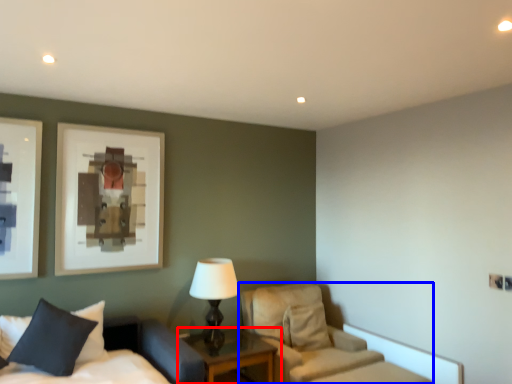
Question: Which object appears farthest to the camera in this image, nightstand (highlighted by a red box) or chair (highlighted by a blue box)?

Choices:
 (A) nightstand
 (B) chair

Answer: (B)